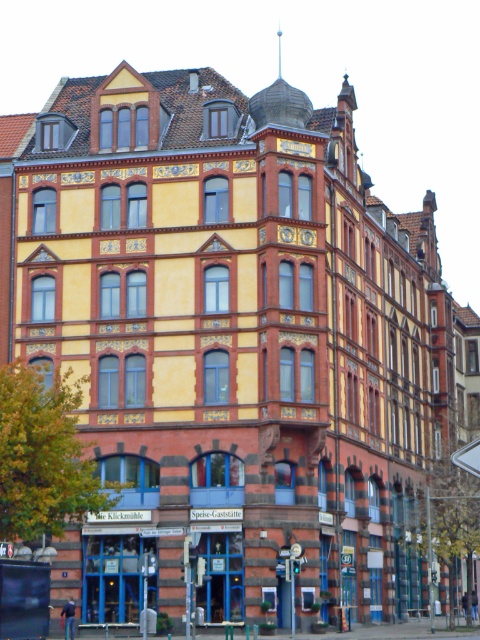
You are a pedestrian standing on the sidewalk in front of the building. You notice the white plastic street sign at lower right and the metallic pole at center. Which object is closer to you?

The white plastic street sign at lower right is closer to you because it is in front of the metallic pole at center.

You are standing at the point marked as point [456,452] and want to reach the entrance of the building. The entrance is located at the base of the building. Considering the distance between you and the entrance, can you estimate how long it would take to walk there at a normal pace of 1.4 meters per second?

The distance between you and the entrance is 49.75 meters. At a normal walking pace of 1.4 meters per second, it would take approximately 35.54 seconds to reach the entrance.